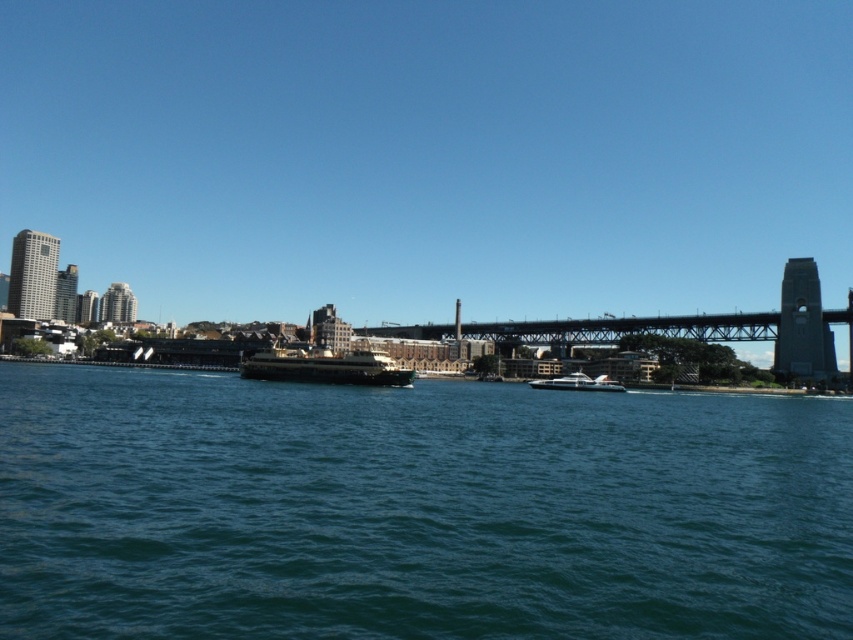
Question: Is shiny black ferry at center to the left of metallic silver boat at center from the viewer's perspective?

Choices:
 (A) yes
 (B) no

Answer: (A)

Question: Which is nearer to the dark gray metallic bridge at center?

Choices:
 (A) metallic silver boat at center
 (B) shiny black ferry at center
 (C) green water at center

Answer: (A)

Question: Which of these objects is positioned farthest from the dark gray metallic bridge at center?

Choices:
 (A) metallic silver boat at center
 (B) green water at center
 (C) shiny black ferry at center

Answer: (B)

Question: Can you confirm if green water at center is positioned below dark gray metallic bridge at center?

Choices:
 (A) yes
 (B) no

Answer: (A)

Question: Does green water at center appear on the right side of metallic silver boat at center?

Choices:
 (A) no
 (B) yes

Answer: (A)

Question: Which point is farther to the camera?

Choices:
 (A) (94, 406)
 (B) (563, 380)
 (C) (779, 317)
 (D) (299, 356)

Answer: (C)